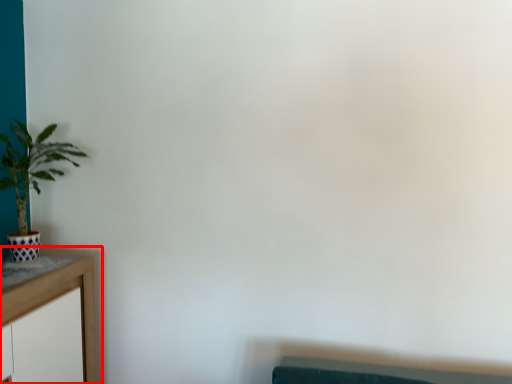
Question: From the image's perspective, what is the correct spatial positioning of table (annotated by the red box) in reference to houseplant?

Choices:
 (A) below
 (B) above

Answer: (A)